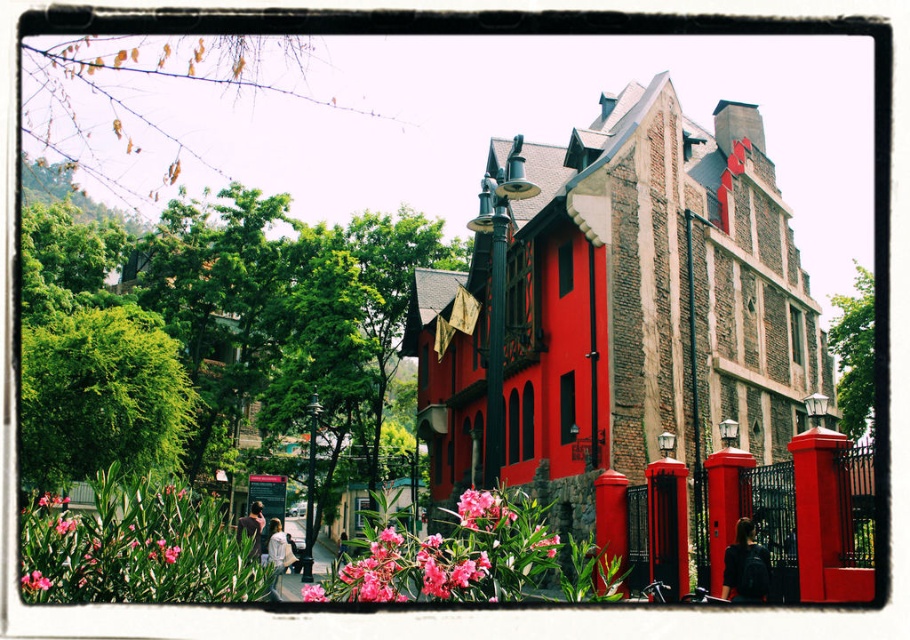
Question: Which point appears farthest from the camera in this image?

Choices:
 (A) (26, 589)
 (B) (500, 531)
 (C) (325, 600)
 (D) (488, 410)

Answer: (D)

Question: Which is farther from the pink matte flower at lower left?

Choices:
 (A) pink matte flower at center
 (B) green matte lamp post at center
 (C) black metal lamp post at center
 (D) pink matte flower at lower center

Answer: (C)

Question: Is pink matte flower at lower left thinner than pink matte flower at center?

Choices:
 (A) yes
 (B) no

Answer: (A)

Question: Which of the following is the farthest from the observer?

Choices:
 (A) (487, 385)
 (B) (44, 589)
 (C) (325, 600)

Answer: (A)

Question: Does green matte lamp post at center appear under pink matte flower at lower left?

Choices:
 (A) yes
 (B) no

Answer: (B)

Question: Where is green matte lamp post at center located in relation to black metal lamp post at center in the image?

Choices:
 (A) right
 (B) left

Answer: (A)